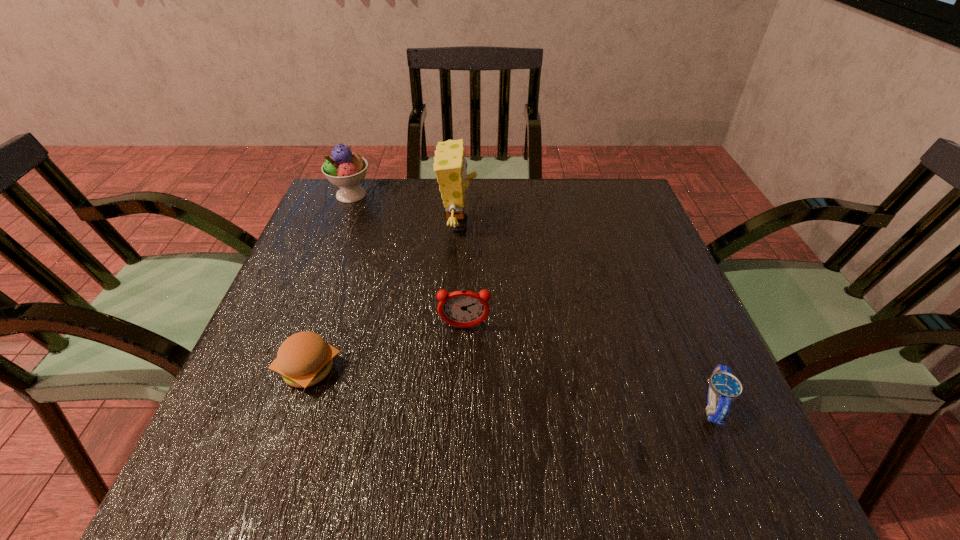
The height and width of the screenshot is (540, 960). I want to click on vacant region at the left edge of the desktop, so (321, 267).

In order to click on vacant space at the right edge of the desktop in this screenshot , I will do `click(607, 256)`.

Locate an element on the screen. This screenshot has height=540, width=960. vacant space at the far right corner of the desktop is located at coordinates (579, 195).

Image resolution: width=960 pixels, height=540 pixels. Find the location of `free space between the third farthest object and the rightmost object`. free space between the third farthest object and the rightmost object is located at coordinates (588, 366).

What are the coordinates of `free spot between the third shortest object and the sponge` in the screenshot? It's located at (462, 276).

The width and height of the screenshot is (960, 540). I want to click on vacant area that lies between the icecream and the hamburger, so click(330, 282).

This screenshot has height=540, width=960. Find the location of `free spot between the sponge and the alarm clock`. free spot between the sponge and the alarm clock is located at coordinates (462, 276).

This screenshot has height=540, width=960. Find the location of `vacant region between the tallest object and the hamburger`. vacant region between the tallest object and the hamburger is located at coordinates (384, 298).

Identify the location of unoccupied position between the hamburger and the sponge. (384, 298).

Locate an element on the screen. empty space between the third shortest object and the rightmost object is located at coordinates point(588,366).